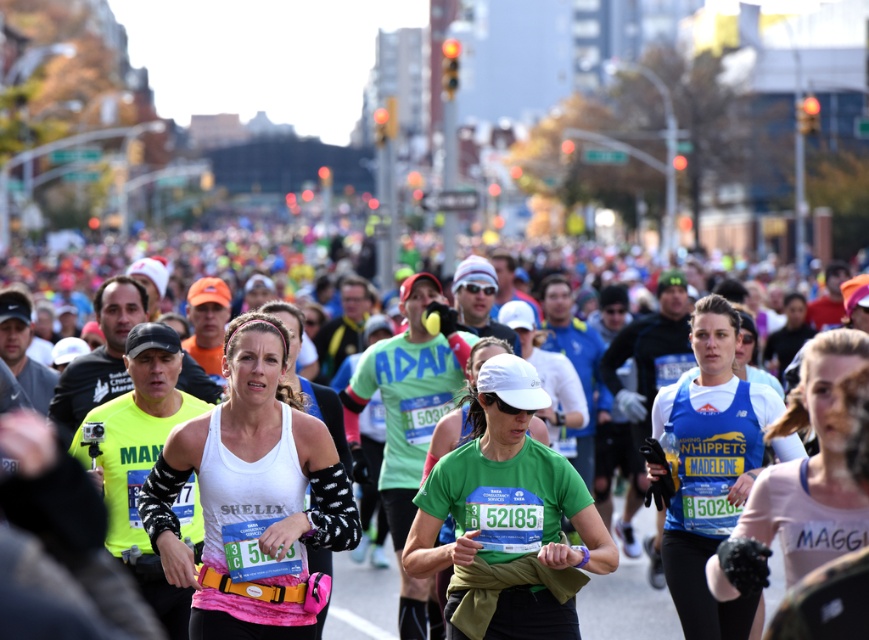
You are a photographer positioned at the starting line of the marathon. You want to capture a closeup of the green fabric shirt at center without moving your camera. Can you do it?

The green fabric shirt at center is 43.55 feet away from viewer, so a standard camera lens can easily capture a closeup of the green fabric shirt at center from that distance without needing to move.

You are a photographer positioned at the starting line of the marathon. You want to take a photo of the green fabric shirt at center and the white fabric runners at center. Which object should you focus on first to ensure it appears sharp in the photo?

The green fabric shirt at center is closer to the viewer than the white fabric runners at center, so you should focus on the green fabric shirt at center first to ensure it appears sharp.

You are a photographer positioned at the starting line of the marathon. You want to take a photo that includes both the point at coordinates point [171,257] and the point at coordinates point [733,557]. Which point should you focus on first to ensure both are in focus?

You should focus on point [171,257] first because it is closer to the camera than point [733,557]. By focusing on the closer point, the farther point will also be within the depth of field, ensuring both are in focus.